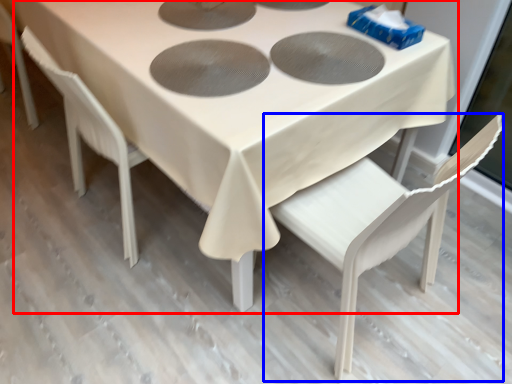
Question: Which point is closer to the camera, table (highlighted by a red box) or chair (highlighted by a blue box)?

Choices:
 (A) table
 (B) chair

Answer: (B)